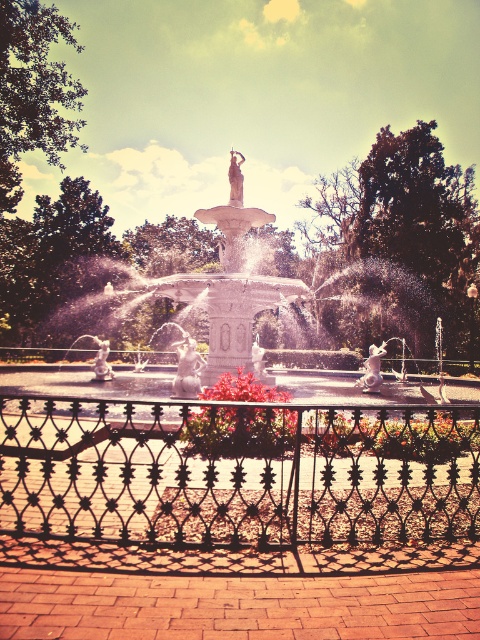
You are a gardener who needs to water the vivid red petals at center and the black wrought iron fence at center. The watering can you have can spray water up to 10 feet. Can you water both objects without moving the can?

The black wrought iron fence at center and vivid red petals at center are 10.46 feet apart from each other. Since the watering can can only spray up to 10 feet, you cannot water both objects without moving the can because the distance between them exceeds the spray range.

You are a gardener who wants to prune the vivid red petals at center without touching the black wrought iron fence at center. Can you reach the petals without moving closer?

The black wrought iron fence at center is not as tall as the vivid red petals at center, so the petals are taller than the fence. This means you can likely reach the petals without moving closer, as they extend above the fence height.

You are a gardener who wants to replace the vivid red petals at center with yellow ones. The black wrought iron fence at center is in the way. Can you move the fence to the side to access the petals?

The black wrought iron fence at center is in the way, but since its width is less than the vivid red petals at center, you can move it to the side to access the petals.